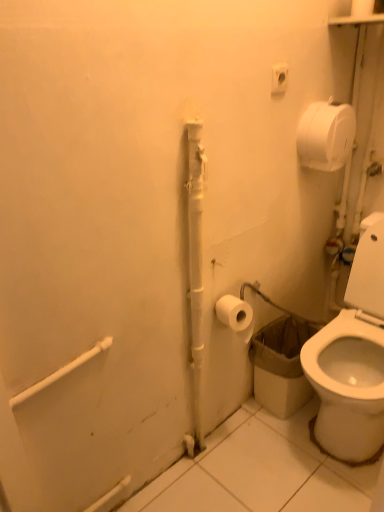
Question: Is white matte toilet paper at upper right, the 2th toilet paper in the bottom-to-top sequence, at the left side of white plastic outlet at upper center?

Choices:
 (A) yes
 (B) no

Answer: (B)

Question: From a real-world perspective, is white matte toilet paper at upper right, the first toilet paper positioned from the right, below white plastic outlet at upper center?

Choices:
 (A) yes
 (B) no

Answer: (A)

Question: Is white plastic outlet at upper center surrounded by white matte toilet paper at upper right, the 2th toilet paper in the bottom-to-top sequence?

Choices:
 (A) no
 (B) yes

Answer: (A)

Question: Does white matte toilet paper at upper right, the first toilet paper positioned from the right, turn towards white plastic outlet at upper center?

Choices:
 (A) yes
 (B) no

Answer: (B)

Question: Is the depth of white matte toilet paper at upper right, positioned as the first toilet paper in top-to-bottom order, greater than that of white plastic outlet at upper center?

Choices:
 (A) no
 (B) yes

Answer: (B)

Question: Is white matte toilet paper at upper right, which is the 2th toilet paper in left-to-right order, bigger than white plastic outlet at upper center?

Choices:
 (A) no
 (B) yes

Answer: (B)

Question: Would you say white matte toilet paper at upper right, the 2th toilet paper in the bottom-to-top sequence, is part of white plastic outlet at upper center's contents?

Choices:
 (A) yes
 (B) no

Answer: (B)

Question: From a real-world perspective, is white plastic outlet at upper center below white matte toilet paper at upper right, which is the 2th toilet paper in left-to-right order?

Choices:
 (A) no
 (B) yes

Answer: (A)

Question: Can you confirm if white plastic outlet at upper center is positioned to the right of white matte toilet paper at upper right, the first toilet paper positioned from the right?

Choices:
 (A) yes
 (B) no

Answer: (B)

Question: Is white plastic outlet at upper center wider than white matte toilet paper at upper right, which is the 2th toilet paper in left-to-right order?

Choices:
 (A) no
 (B) yes

Answer: (A)

Question: Is white plastic outlet at upper center aimed at white matte toilet paper at upper right, the 2th toilet paper in the bottom-to-top sequence?

Choices:
 (A) no
 (B) yes

Answer: (A)

Question: Can you confirm if white plastic outlet at upper center is taller than white matte toilet paper at upper right, the first toilet paper positioned from the right?

Choices:
 (A) yes
 (B) no

Answer: (B)

Question: Is white matte toilet paper at lower right, which is counted as the 2th toilet paper, starting from the right, closer to the viewer compared to white plastic outlet at upper center?

Choices:
 (A) no
 (B) yes

Answer: (A)